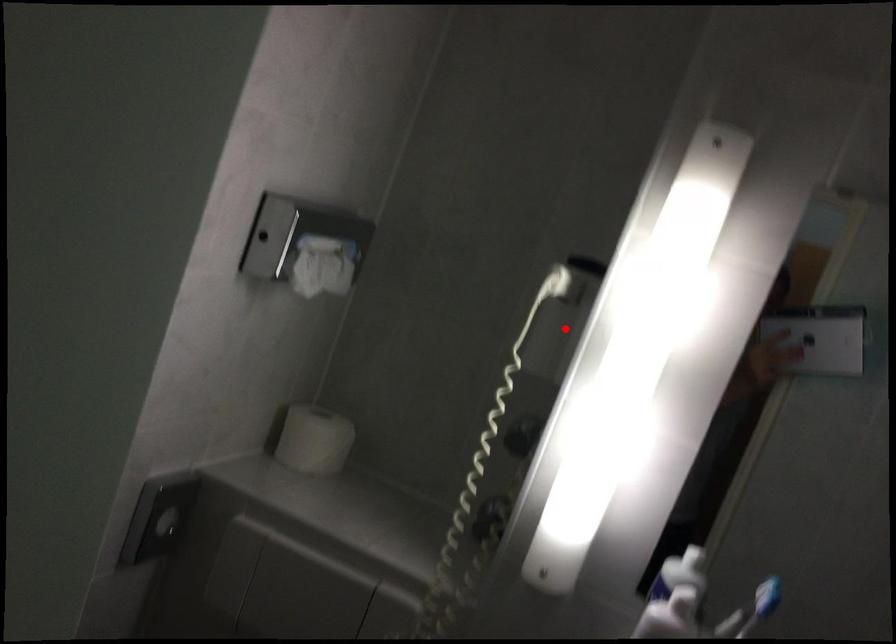
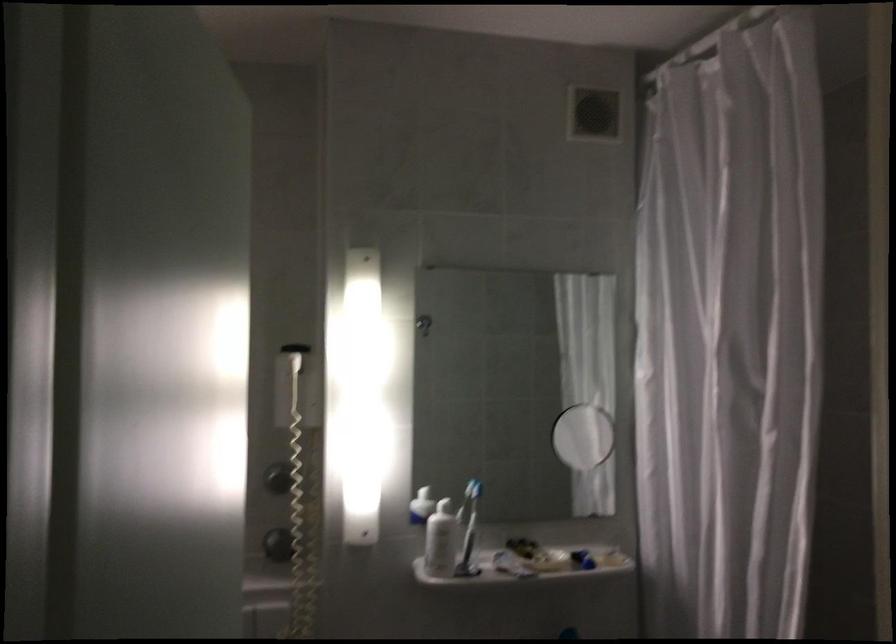
The point at the highlighted location is marked in the first image. Where is the corresponding point in the second image?

(295, 386)